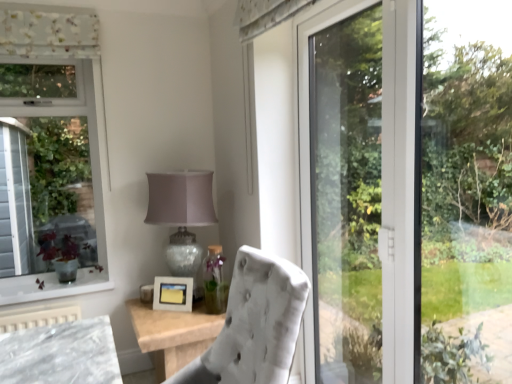
Where is `transparent glass door at right`? The height and width of the screenshot is (384, 512). transparent glass door at right is located at coordinates (409, 193).

Measure the distance between point (x=283, y=330) and camera.

Point (x=283, y=330) and camera are 3.85 feet apart.

What is the approximate height of white matte picture frame at center?

It is 20.35 centimeters.

This screenshot has height=384, width=512. In order to click on matte glass table lamp at center in this screenshot , I will do `click(182, 215)`.

Is velvet white chair at center at the right side of matte glass table lamp at center?

Yes.

Is velvet white chair at center shorter than matte glass table lamp at center?

Correct, velvet white chair at center is not as tall as matte glass table lamp at center.

Looking at this image, from the image's perspective, which is below, velvet white chair at center or matte glass table lamp at center?

velvet white chair at center appears lower in the image.

From a real-world perspective, which is physically above, velvet white chair at center or matte glass table lamp at center?

matte glass table lamp at center, from a real-world perspective.

Does matte glass table lamp at center contain transparent glass door at right?

No, transparent glass door at right is not surrounded by matte glass table lamp at center.

Is matte glass table lamp at center far away from transparent glass door at right?

No, matte glass table lamp at center is in close proximity to transparent glass door at right.

Consider the image. Considering the relative sizes of matte glass table lamp at center and transparent glass door at right in the image provided, is matte glass table lamp at center shorter than transparent glass door at right?

Yes, matte glass table lamp at center is shorter than transparent glass door at right.

Considering the positions of objects matte glass table lamp at center and transparent glass door at right in the image provided, who is more to the right, matte glass table lamp at center or transparent glass door at right?

Positioned to the right is transparent glass door at right.

Is transparent glass door at right wider or thinner than velvet white chair at center?

transparent glass door at right is thinner than velvet white chair at center.

Is velvet white chair at center inside transparent glass door at right?

No, velvet white chair at center is not surrounded by transparent glass door at right.

Is transparent glass door at right smaller than velvet white chair at center?

Yes, transparent glass door at right is smaller than velvet white chair at center.

From the image's perspective, which is above, transparent glass door at right or velvet white chair at center?

transparent glass door at right.

Which object is closer to the camera taking this photo, matte glass table lamp at center or white matte picture frame at center?

matte glass table lamp at center is closer to the camera.

Considering the sizes of objects matte glass table lamp at center and white matte picture frame at center in the image provided, who is smaller, matte glass table lamp at center or white matte picture frame at center?

white matte picture frame at center is smaller.

Which point is more distant from viewer, (175,210) or (167,296)?

Point (167,296)

Is matte glass table lamp at center looking in the opposite direction of white matte picture frame at center?

No, white matte picture frame at center is not at the back of matte glass table lamp at center.

Considering the sizes of objects white matte picture frame at center and matte glass table lamp at center in the image provided, who is smaller, white matte picture frame at center or matte glass table lamp at center?

white matte picture frame at center is smaller.

Would you say white matte picture frame at center is a long distance from matte glass table lamp at center?

No, white matte picture frame at center is not far away from matte glass table lamp at center.

Is point (159, 308) less distant than point (179, 203)?

No, (159, 308) is further to viewer.

From the image's perspective, does white matte picture frame at center appear lower than matte glass table lamp at center?

Yes.

Can you confirm if velvet white chair at center is taller than transparent glass door at right?

No.

Is velvet white chair at center thinner than transparent glass door at right?

Incorrect, the width of velvet white chair at center is not less than that of transparent glass door at right.

Can you tell me how much velvet white chair at center and white matte picture frame at center differ in facing direction?

The angular difference between velvet white chair at center and white matte picture frame at center is 54 degrees.

Is velvet white chair at center to the left of white matte picture frame at center from the viewer's perspective?

No.

Can you confirm if velvet white chair at center is thinner than white matte picture frame at center?

No.

From the image's perspective, is velvet white chair at center above white matte picture frame at center?

Yes, from the image's perspective, velvet white chair at center is over white matte picture frame at center.

Where is `chair located below the matte glass table lamp at center (from the image's perspective)`? Image resolution: width=512 pixels, height=384 pixels. chair located below the matte glass table lamp at center (from the image's perspective) is located at coordinates (255, 324).

Where is `glass door above the matte glass table lamp at center (from the image's perspective)`? glass door above the matte glass table lamp at center (from the image's perspective) is located at coordinates (409, 193).

When comparing their distances from matte glass table lamp at center, does velvet white chair at center or transparent glass door at right seem further?

velvet white chair at center is further to matte glass table lamp at center.

Which object lies further to the anchor point transparent glass door at right, white matte picture frame at center or velvet white chair at center?

Among the two, white matte picture frame at center is located further to transparent glass door at right.

Estimate the real-world distances between objects in this image. Which object is closer to matte glass table lamp at center, white matte picture frame at center or velvet white chair at center?

white matte picture frame at center is closer to matte glass table lamp at center.

Considering their positions, is transparent glass door at right positioned further to white matte picture frame at center than velvet white chair at center?

Based on the image, transparent glass door at right appears to be further to white matte picture frame at center.

Considering their positions, is velvet white chair at center positioned closer to transparent glass door at right than matte glass table lamp at center?

Among the two, matte glass table lamp at center is located nearer to transparent glass door at right.

When comparing their distances from white matte picture frame at center, does velvet white chair at center or matte glass table lamp at center seem closer?

matte glass table lamp at center.

Based on their spatial positions, is transparent glass door at right or white matte picture frame at center closer to velvet white chair at center?

The object closer to velvet white chair at center is transparent glass door at right.

Looking at the image, which one is located closer to matte glass table lamp at center, white matte picture frame at center or transparent glass door at right?

white matte picture frame at center is positioned closer to the anchor matte glass table lamp at center.

In order to click on glass door positioned between velvet white chair at center and white matte picture frame at center from near to far in this screenshot , I will do `click(409, 193)`.

At what (x,y) coordinates should I click in order to perform the action: click on glass door located between velvet white chair at center and matte glass table lamp at center in the depth direction. Please return your answer as a coordinate pair (x, y). Looking at the image, I should click on (409, 193).

Find the location of a particular element. table lamp between transparent glass door at right and white matte picture frame at center in the front-back direction is located at coordinates (182, 215).

Find the location of `table lamp between velvet white chair at center and white matte picture frame at center in the front-back direction`. table lamp between velvet white chair at center and white matte picture frame at center in the front-back direction is located at coordinates (182, 215).